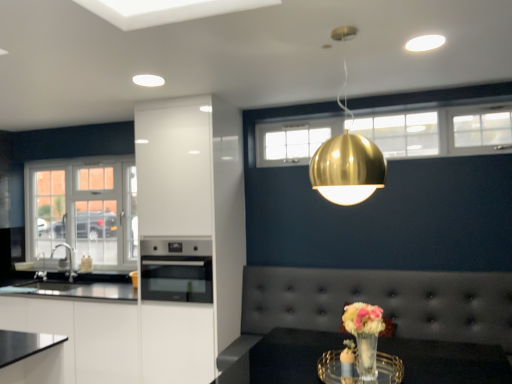
Question: From a real-world perspective, relative to gold metallic sphere at upper center, is tufted leather couch at center vertically above or below?

Choices:
 (A) above
 (B) below

Answer: (B)

Question: Is tufted leather couch at center taller or shorter than gold metallic sphere at upper center?

Choices:
 (A) short
 (B) tall

Answer: (A)

Question: Which is nearer to the stainless steel oven at center?

Choices:
 (A) white glossy cabinet at center
 (B) white glossy cabinet at lower left
 (C) gold metallic sphere at upper center
 (D) translucent glass vase at lower center
 (E) tufted leather couch at center

Answer: (A)

Question: Which object is positioned farthest from the stainless steel oven at center?

Choices:
 (A) white glass window at left
 (B) tufted leather couch at center
 (C) white glossy cabinet at lower left
 (D) gold metallic sphere at upper center
 (E) clear glass tray at lower center

Answer: (E)